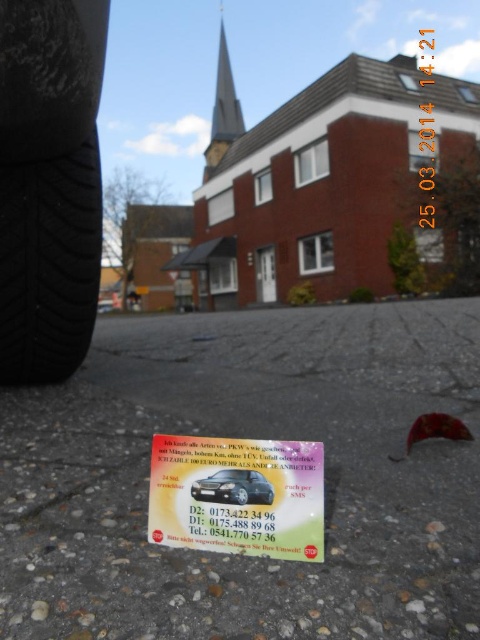
Question: Which point is farther to the camera?

Choices:
 (A) black rubber tire at left
 (B) black glossy car at lower center

Answer: (A)

Question: Which point is farther to the camera?

Choices:
 (A) (75, 278)
 (B) (250, 500)

Answer: (A)

Question: Does black rubber tire at left have a greater width compared to black glossy car at lower center?

Choices:
 (A) no
 (B) yes

Answer: (B)

Question: Among these objects, which one is farthest from the camera?

Choices:
 (A) black rubber tire at left
 (B) black glossy car at lower center

Answer: (A)

Question: Is black rubber tire at left below black glossy car at lower center?

Choices:
 (A) yes
 (B) no

Answer: (B)

Question: Can you confirm if black rubber tire at left is smaller than black glossy car at lower center?

Choices:
 (A) no
 (B) yes

Answer: (A)